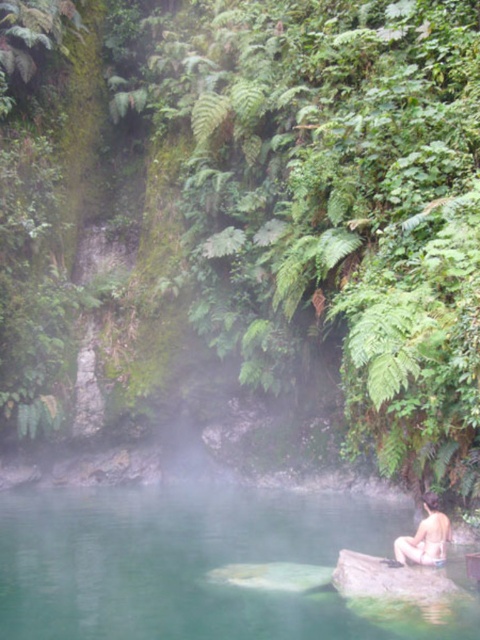
Question: Does green smooth water at lower center lie behind nude human at lower right?

Choices:
 (A) no
 (B) yes

Answer: (A)

Question: Is green smooth water at lower center smaller than nude human at lower right?

Choices:
 (A) yes
 (B) no

Answer: (B)

Question: Where is green smooth water at lower center located in relation to nude human at lower right in the image?

Choices:
 (A) right
 (B) left

Answer: (B)

Question: Which point is farther to the camera?

Choices:
 (A) (425, 563)
 (B) (52, 637)

Answer: (A)

Question: Which point appears closest to the camera in this image?

Choices:
 (A) (280, 502)
 (B) (432, 502)

Answer: (B)